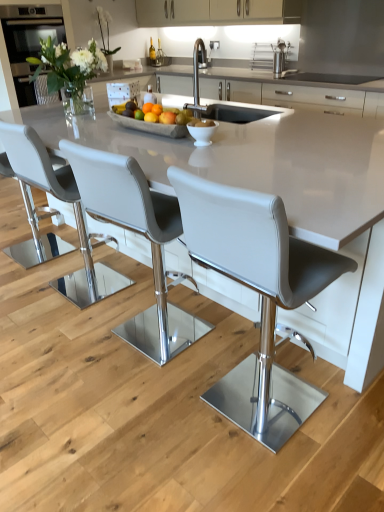
Question: Is matte gray chair at center, which is the 1th chair in right-to-left order, positioned far away from matte black oven at upper left?

Choices:
 (A) yes
 (B) no

Answer: (A)

Question: Does matte gray chair at center, which is the fourth chair in left-to-right order, have a greater height compared to matte black oven at upper left?

Choices:
 (A) yes
 (B) no

Answer: (A)

Question: Is matte black oven at upper left at the back of matte gray chair at center, which is the fourth chair in left-to-right order?

Choices:
 (A) yes
 (B) no

Answer: (B)

Question: From a real-world perspective, is matte gray chair at center, which is the fourth chair in left-to-right order, over matte black oven at upper left?

Choices:
 (A) no
 (B) yes

Answer: (A)

Question: Considering the relative sizes of matte gray chair at center, which is the 1th chair in right-to-left order, and matte black oven at upper left in the image provided, is matte gray chair at center, which is the 1th chair in right-to-left order, wider than matte black oven at upper left?

Choices:
 (A) no
 (B) yes

Answer: (A)

Question: Is matte gray chair at center, which is the 1th chair in right-to-left order, outside of matte black oven at upper left?

Choices:
 (A) no
 (B) yes

Answer: (B)

Question: Could you tell me if white ceramic bowl at center is facing matte gray chair at center, which is the 1th chair in right-to-left order?

Choices:
 (A) no
 (B) yes

Answer: (A)

Question: Would you say white ceramic bowl at center is a long distance from matte gray chair at center, which is the 1th chair in right-to-left order?

Choices:
 (A) no
 (B) yes

Answer: (B)

Question: From the image's perspective, is white ceramic bowl at center under matte gray chair at center, which is the 1th chair in right-to-left order?

Choices:
 (A) yes
 (B) no

Answer: (B)

Question: Can you confirm if white ceramic bowl at center is thinner than matte gray chair at center, which is the 1th chair in right-to-left order?

Choices:
 (A) no
 (B) yes

Answer: (B)

Question: Can you confirm if white ceramic bowl at center is wider than matte gray chair at center, which is the fourth chair in left-to-right order?

Choices:
 (A) no
 (B) yes

Answer: (A)

Question: Considering the relative sizes of white ceramic bowl at center and matte gray chair at center, which is the 1th chair in right-to-left order, in the image provided, is white ceramic bowl at center taller than matte gray chair at center, which is the 1th chair in right-to-left order,?

Choices:
 (A) yes
 (B) no

Answer: (B)

Question: Is orange matte at center, arranged as the 1th orange when viewed from the back, at the back of matte black oven at upper left?

Choices:
 (A) yes
 (B) no

Answer: (B)